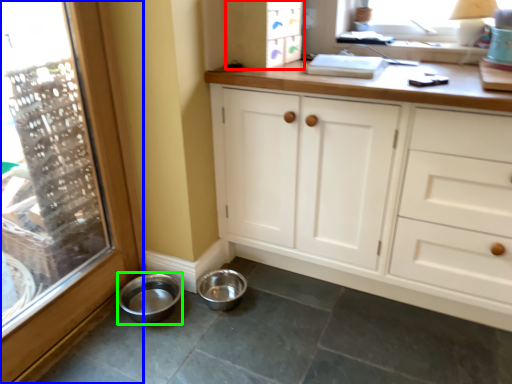
Question: Which object is positioned farthest from cabinetry (highlighted by a red box)? Select from window (highlighted by a blue box) and basin (highlighted by a green box).

Choices:
 (A) window
 (B) basin

Answer: (B)